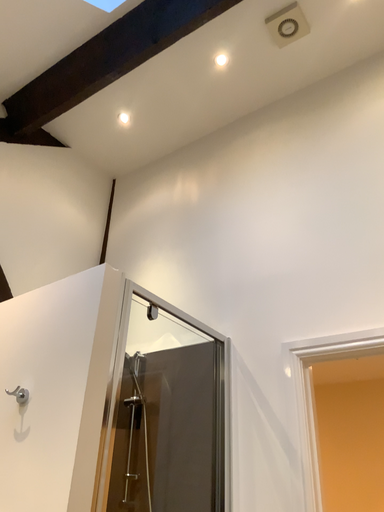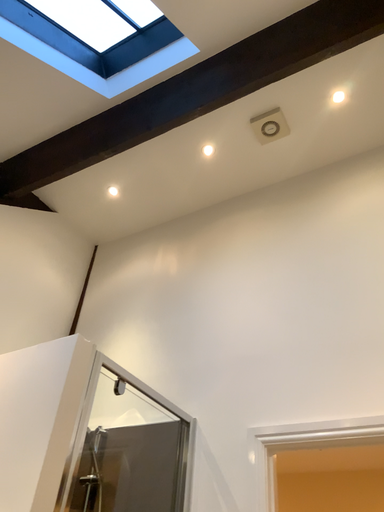
Question: Which way did the camera rotate in the video?

Choices:
 (A) rotated downward
 (B) rotated upward

Answer: (B)